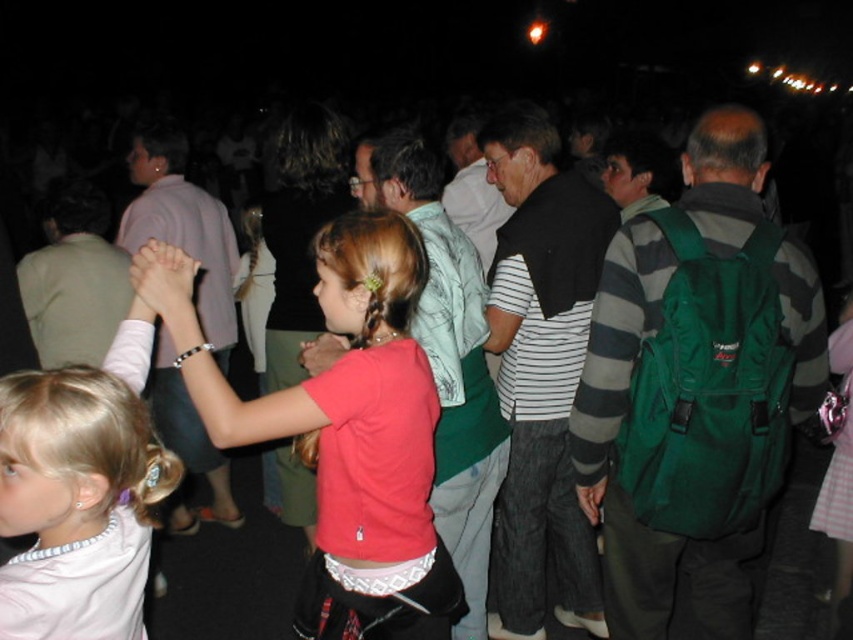
Question: Does matte pink shirt at center come in front of light pink fabric shirt at center?

Choices:
 (A) yes
 (B) no

Answer: (B)

Question: Which object is farther from the camera taking this photo?

Choices:
 (A) light pink fabric shirt at center
 (B) matte pink shirt at center

Answer: (B)

Question: Does matte pink shirt at center appear on the left side of light pink fabric shirt at center?

Choices:
 (A) no
 (B) yes

Answer: (A)

Question: Which object is farther from the camera taking this photo?

Choices:
 (A) light pink fabric shirt at center
 (B) matte pink shirt at center

Answer: (B)

Question: Does matte pink shirt at center lie behind light pink fabric shirt at center?

Choices:
 (A) no
 (B) yes

Answer: (B)